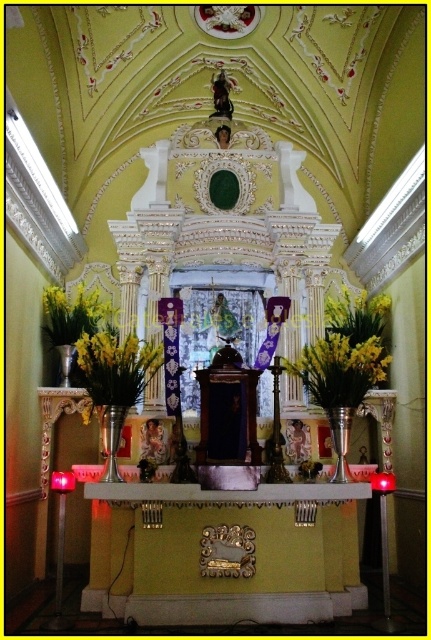
Is yellow matte flowers at center shorter than yellow matte vase at center?

No, yellow matte flowers at center is not shorter than yellow matte vase at center.

Between yellow matte flowers at center and yellow matte vase at center, which one is positioned lower?

yellow matte flowers at center is below.

Find the location of a particular element. yellow matte flowers at center is located at coordinates (340, 364).

Is point (337, 371) positioned in front of point (362, 346)?

Yes, it is.

Locate an element on the screen. The image size is (431, 640). yellow artificial flowers at center is located at coordinates (344, 352).

Where is `yellow artificial flowers at center`? The height and width of the screenshot is (640, 431). yellow artificial flowers at center is located at coordinates (344, 352).

Is point (343, 403) farther from camera compared to point (97, 362)?

Yes, point (343, 403) is behind point (97, 362).

Is yellow artificial flowers at center bigger than yellow matte vase at center?

Indeed, yellow artificial flowers at center has a larger size compared to yellow matte vase at center.

Measure the distance between yellow artificial flowers at center and camera.

A distance of 191.08 feet exists between yellow artificial flowers at center and camera.

Identify the location of yellow artificial flowers at center. This screenshot has width=431, height=640. coord(344,352).